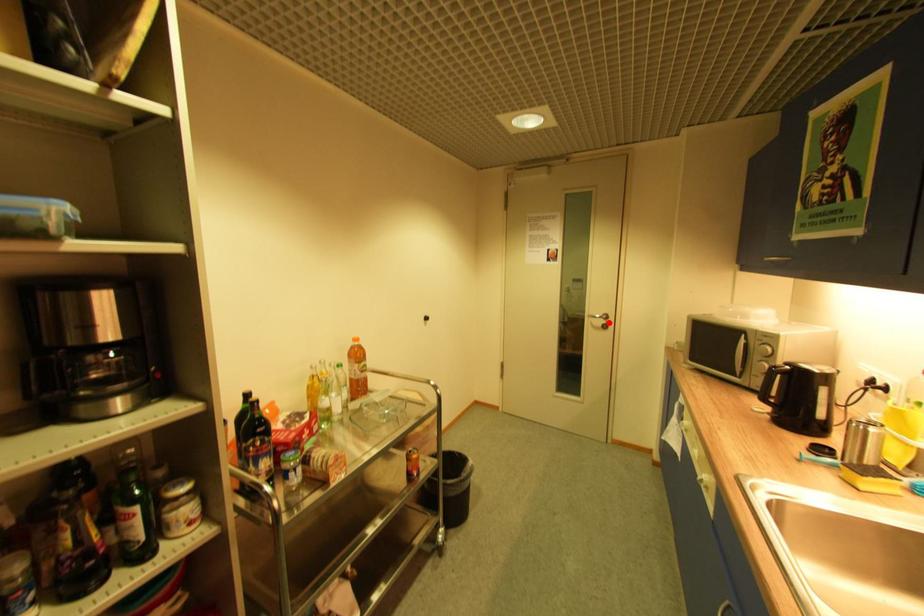
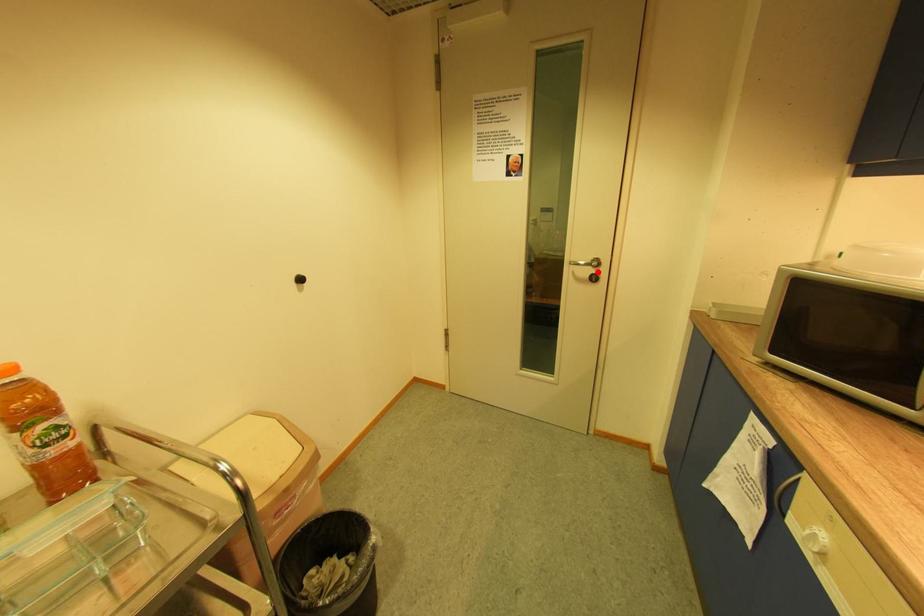
I am providing you with two images of the same scene from different viewpoints. A red point is marked on the first image and another point is marked on the second image. Does the point marked in image1 correspond to the same location as the one in image2?

Yes